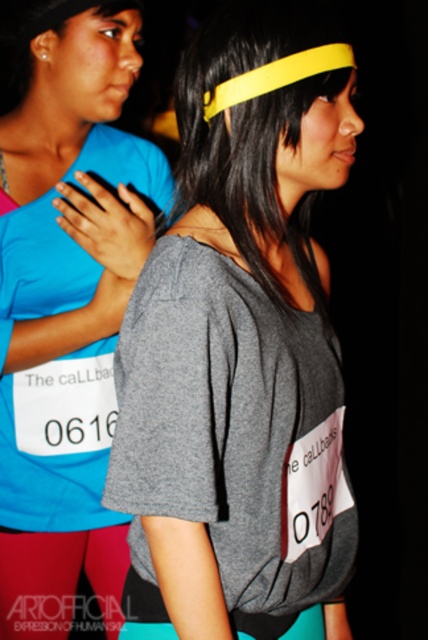
Question: Which point is farther from the camera taking this photo?

Choices:
 (A) (89, 28)
 (B) (124, 550)
 (C) (205, 339)

Answer: (B)

Question: Can you confirm if matte blue shirt at left is thinner than matte pink leggings at lower left?

Choices:
 (A) yes
 (B) no

Answer: (B)

Question: Which point is farther to the camera?

Choices:
 (A) matte blue shirt at left
 (B) gray matte t-shirt at center

Answer: (A)

Question: Which point appears farthest from the camera in this image?

Choices:
 (A) (100, 161)
 (B) (186, 435)

Answer: (A)

Question: Can you confirm if gray matte t-shirt at center is positioned to the left of matte pink leggings at lower left?

Choices:
 (A) no
 (B) yes

Answer: (A)

Question: Does matte blue shirt at left appear over matte pink leggings at lower left?

Choices:
 (A) no
 (B) yes

Answer: (B)